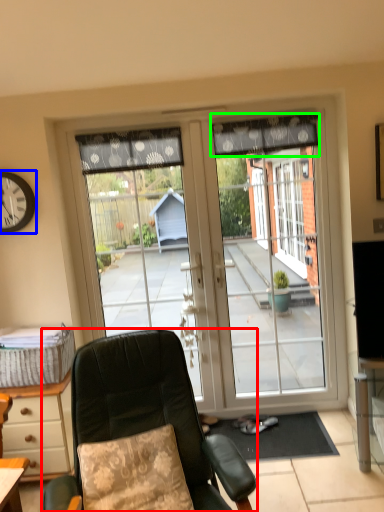
Question: Based on their relative distances, which object is nearer to chair (highlighted by a red box)? Choose from clock (highlighted by a blue box) and curtain (highlighted by a green box).

Choices:
 (A) clock
 (B) curtain

Answer: (A)